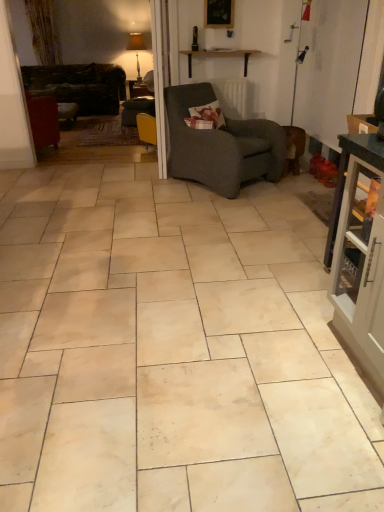
Image resolution: width=384 pixels, height=512 pixels. What are the coordinates of `vacant space situated on the left part of matte gray cabinet at right` in the screenshot? It's located at (278, 369).